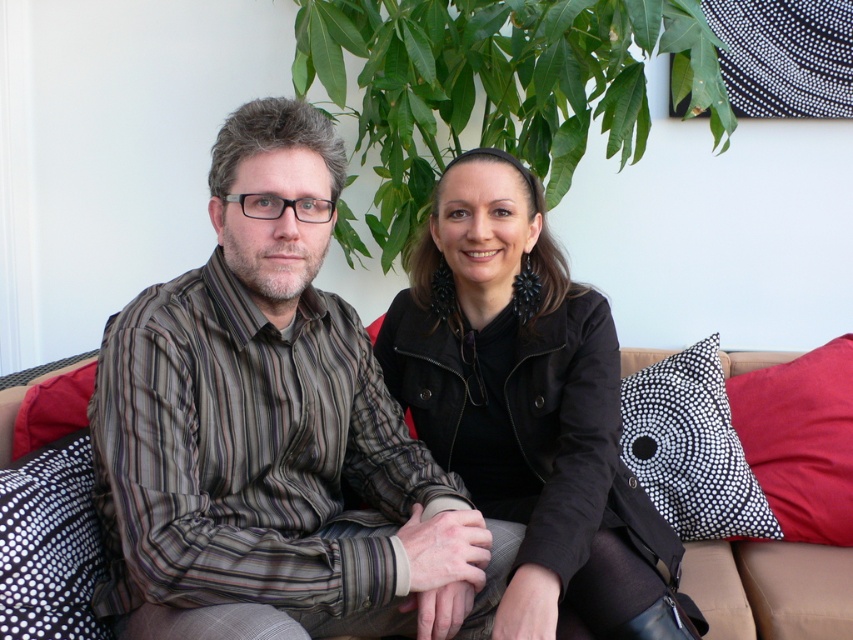
Question: Is black dotted pillow at lower right above black dotted pillow at lower left?

Choices:
 (A) no
 (B) yes

Answer: (B)

Question: Which point is closer to the camera?

Choices:
 (A) black leather jacket at center
 (B) black dotted fabric pillow at right

Answer: (A)

Question: Considering the real-world distances, which object is farthest from the black dotted pillow at lower right?

Choices:
 (A) striped cotton shirt at center
 (B) black dotted pillow at lower left
 (C) black leather jacket at center

Answer: (B)

Question: Which object appears closest to the camera in this image?

Choices:
 (A) red fabric pillow at left
 (B) black leather jacket at center

Answer: (B)

Question: Considering the relative positions of striped cotton shirt at center and black leather jacket at center in the image provided, where is striped cotton shirt at center located with respect to black leather jacket at center?

Choices:
 (A) left
 (B) right

Answer: (A)

Question: Is striped cotton shirt at center positioned behind beige fabric couch at center?

Choices:
 (A) no
 (B) yes

Answer: (A)